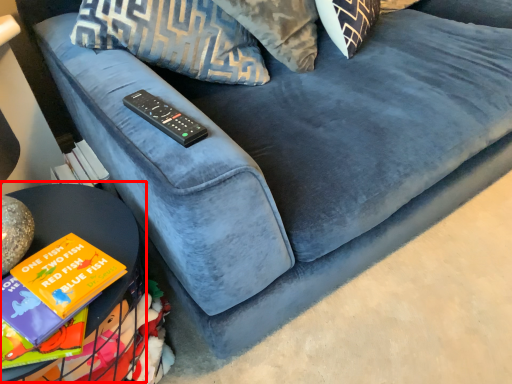
Question: From the image's perspective, where is table (annotated by the red box) located relative to remote?

Choices:
 (A) above
 (B) below

Answer: (B)